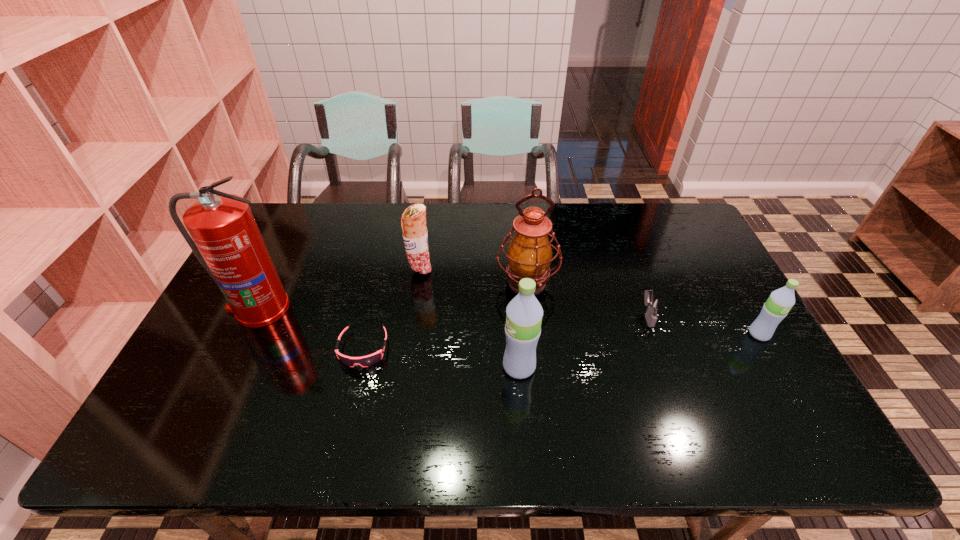
Where is `object that is at the near edge`? The width and height of the screenshot is (960, 540). object that is at the near edge is located at coordinates (524, 313).

This screenshot has height=540, width=960. I want to click on object positioned at the left edge, so click(226, 240).

This screenshot has width=960, height=540. I want to click on object located at the right edge, so [x=775, y=309].

The width and height of the screenshot is (960, 540). In the image, there is a desktop. Identify the location of free region at the far edge. (600, 226).

In the image, there is a desktop. Where is `vacant area at the near edge`? This screenshot has height=540, width=960. vacant area at the near edge is located at coordinates (644, 381).

The width and height of the screenshot is (960, 540). What are the coordinates of `vacant space at the left edge of the desktop` in the screenshot? It's located at point(244,366).

At what (x,y) coordinates should I click in order to perform the action: click on vacant area at the right edge of the desktop. Please return your answer as a coordinate pair (x, y). Looking at the image, I should click on (748, 368).

You are a GUI agent. You are given a task and a screenshot of the screen. Output one action in this format:
    pyautogui.click(x=<x>, y=<y>)
    Task: Click on the free space at the far left corner of the desktop
    This screenshot has width=960, height=540.
    Given the screenshot: What is the action you would take?
    pyautogui.click(x=303, y=214)

The height and width of the screenshot is (540, 960). I want to click on empty space between the shorter water bottle and the oil lamp, so click(643, 308).

Where is `vacant area between the leftmost object and the burrito`? This screenshot has width=960, height=540. vacant area between the leftmost object and the burrito is located at coordinates (340, 289).